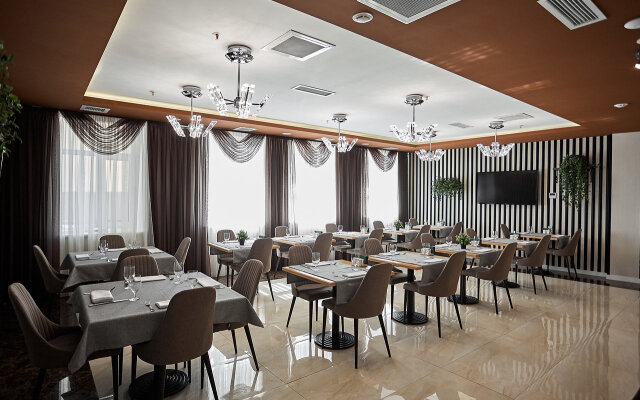
Where is `square shaped tables`? square shaped tables is located at coordinates (153, 295), (118, 255), (239, 242), (406, 232), (440, 228), (342, 276), (470, 253), (502, 242), (536, 233).